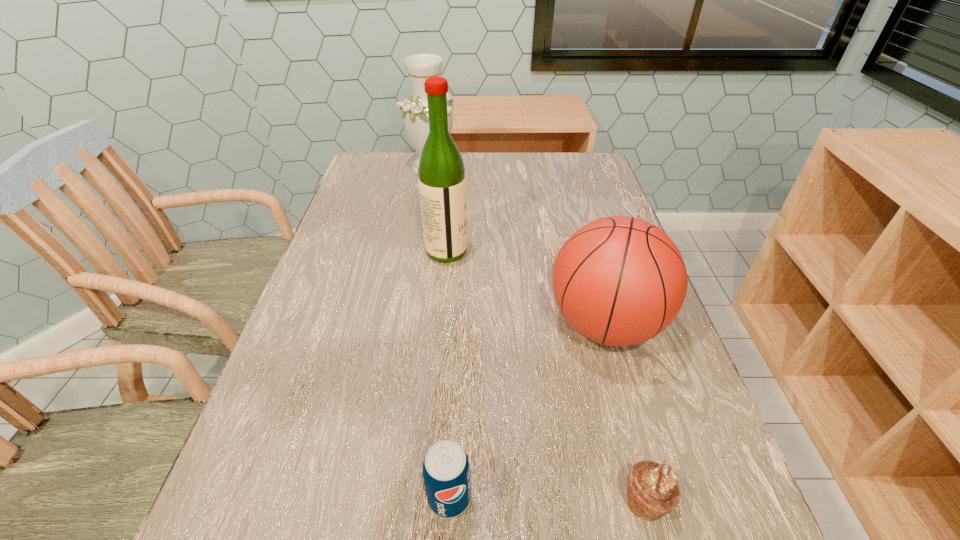
The height and width of the screenshot is (540, 960). I want to click on the second farthest object, so click(441, 173).

The image size is (960, 540). Find the location of `the tallest object`. the tallest object is located at coordinates pyautogui.click(x=441, y=173).

Find the location of a particular element. The height and width of the screenshot is (540, 960). vase is located at coordinates (420, 67).

Locate an element on the screen. The width and height of the screenshot is (960, 540). the fourth shortest object is located at coordinates (420, 67).

This screenshot has width=960, height=540. Find the location of `the third farthest object`. the third farthest object is located at coordinates click(619, 280).

Find the location of a particular element. The image size is (960, 540). the third tallest object is located at coordinates (619, 280).

You are a GUI agent. You are given a task and a screenshot of the screen. Output one action in this format:
    pyautogui.click(x=<x>, y=<y>)
    Task: Click on the pop
    
    Given the screenshot: What is the action you would take?
    pyautogui.click(x=446, y=469)

What are the coordinates of `muffin` in the screenshot? It's located at pos(653,491).

Image resolution: width=960 pixels, height=540 pixels. In order to click on vacant space located on the label of the liquor in this screenshot , I will do `click(591, 251)`.

I want to click on free region located 0.130m on the front of the farthest object, so click(x=425, y=204).